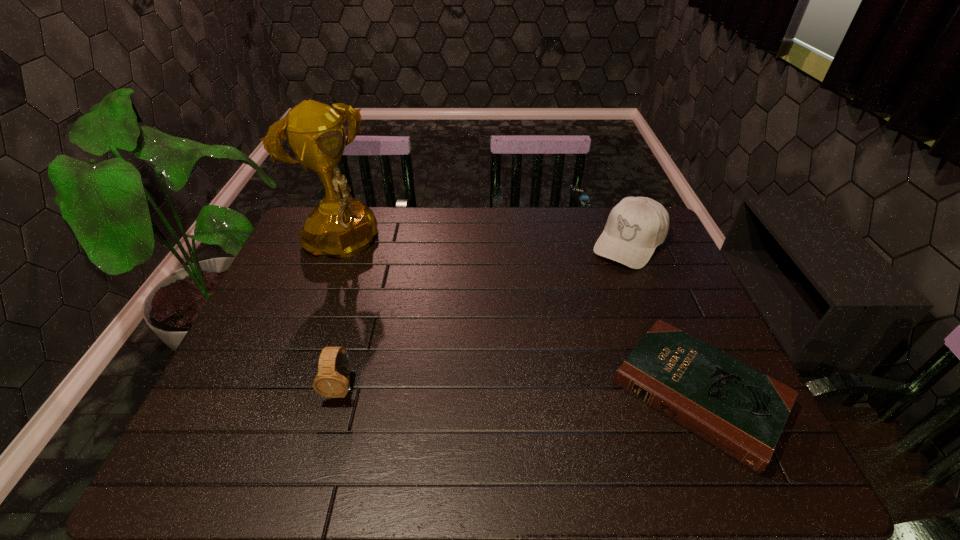
The height and width of the screenshot is (540, 960). Identify the location of free region located on the front side of the award. (387, 295).

Locate an element on the screen. Image resolution: width=960 pixels, height=540 pixels. baseball cap that is at the far edge is located at coordinates (636, 225).

At what (x,y) coordinates should I click in order to perform the action: click on award that is at the far edge. Please return your answer as a coordinate pair (x, y). The image size is (960, 540). Looking at the image, I should click on (341, 226).

The width and height of the screenshot is (960, 540). I want to click on watch situated at the near edge, so tap(333, 378).

Image resolution: width=960 pixels, height=540 pixels. Find the location of `Bible at the near edge`. Bible at the near edge is located at coordinates (737, 409).

You are a GUI agent. You are given a task and a screenshot of the screen. Output one action in this format:
    pyautogui.click(x=<x>, y=<y>)
    Task: Click on the object that is at the left edge
    
    Given the screenshot: What is the action you would take?
    pyautogui.click(x=341, y=226)

At what (x,y) coordinates should I click in order to perform the action: click on Bible located in the right edge section of the desktop. Please return your answer as a coordinate pair (x, y). Looking at the image, I should click on (737, 409).

Locate an element on the screen. This screenshot has height=540, width=960. baseball cap present at the right edge is located at coordinates (636, 225).

Identify the location of object that is at the far left corner. The height and width of the screenshot is (540, 960). (341, 226).

Find the location of a particular element. Image resolution: width=960 pixels, height=540 pixels. object at the far right corner is located at coordinates click(x=636, y=225).